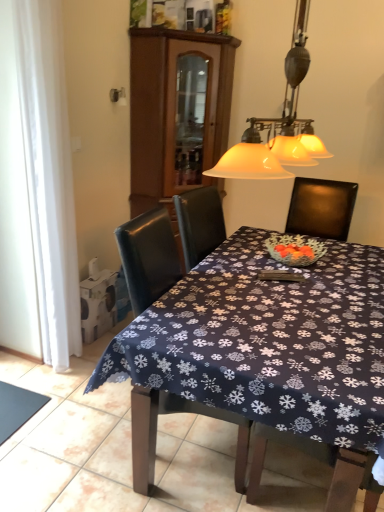
Find the location of a particular element. dark blue fabric at lower left is located at coordinates (17, 408).

The image size is (384, 512). Describe the element at coordinates (148, 257) in the screenshot. I see `leather chair at center` at that location.

Where is `leather chair at center`? leather chair at center is located at coordinates (148, 257).

Locate an element on the screen. This screenshot has height=512, width=384. brown wood cabinet at upper center is located at coordinates (176, 113).

Locate an element on the screen. dark blue fabric at lower left is located at coordinates (17, 408).

Is leather chair at center turned away from brown wood cabinet at upper center?

No.

How many degrees apart are the facing directions of leather chair at center and brown wood cabinet at upper center?

leather chair at center and brown wood cabinet at upper center are facing 44.6 degrees away from each other.

Which is behind, leather chair at center or brown wood cabinet at upper center?

brown wood cabinet at upper center.

Based on the photo, considering the sizes of leather chair at center and brown wood cabinet at upper center in the image, is leather chair at center taller or shorter than brown wood cabinet at upper center?

leather chair at center is shorter than brown wood cabinet at upper center.

Consider the image. Can you confirm if dark blue fabric at lower left is shorter than white glass lampshade at upper center?

Correct, dark blue fabric at lower left is not as tall as white glass lampshade at upper center.

From a real-world perspective, does dark blue fabric at lower left sit lower than white glass lampshade at upper center?

Yes, from a real-world perspective, dark blue fabric at lower left is below white glass lampshade at upper center.

Is leather chair at center positioned far away from dark blue fabric tablecloth at center?

No.

Based on the photo, is dark blue fabric tablecloth at center surrounded by leather chair at center?

No.

From a real-world perspective, which object rests below the other?

dark blue fabric tablecloth at center.

Is leather chair at center aimed at dark blue fabric tablecloth at center?

Yes, leather chair at center faces towards dark blue fabric tablecloth at center.

Is white sheer curtain at left shorter than dark blue fabric at lower left?

No.

From a real-world perspective, is white sheer curtain at left positioned above or below dark blue fabric at lower left?

In terms of real-world spatial position, white sheer curtain at left is above dark blue fabric at lower left.

Does white sheer curtain at left appear on the right side of dark blue fabric at lower left?

Correct, you'll find white sheer curtain at left to the right of dark blue fabric at lower left.

Is white sheer curtain at left situated inside dark blue fabric at lower left or outside?

white sheer curtain at left is outside dark blue fabric at lower left.

Is white sheer curtain at left far away from brown wood cabinet at upper center?

Absolutely, white sheer curtain at left is distant from brown wood cabinet at upper center.

Where is `curtain that is in front of the brown wood cabinet at upper center`? Image resolution: width=384 pixels, height=512 pixels. curtain that is in front of the brown wood cabinet at upper center is located at coordinates (49, 176).

Is white sheer curtain at left thinner than brown wood cabinet at upper center?

Yes, white sheer curtain at left is thinner than brown wood cabinet at upper center.

Can you confirm if white sheer curtain at left is positioned to the left of brown wood cabinet at upper center?

Correct, you'll find white sheer curtain at left to the left of brown wood cabinet at upper center.

Which point is more forward, (236, 166) or (142, 210)?

The point (236, 166) is closer.

Consider the image. Measure the distance between white glass lampshade at upper center and brown wood cabinet at upper center.

They are 1.13 meters apart.

How different are the orientations of white glass lampshade at upper center and brown wood cabinet at upper center in degrees?

They differ by 41 degrees in their facing directions.

Considering the relative sizes of white glass lampshade at upper center and brown wood cabinet at upper center in the image provided, is white glass lampshade at upper center taller than brown wood cabinet at upper center?

No.

Considering the positions of objects dark blue fabric tablecloth at center and brown wood cabinet at upper center in the image provided, who is more to the left, dark blue fabric tablecloth at center or brown wood cabinet at upper center?

From the viewer's perspective, brown wood cabinet at upper center appears more on the left side.

Between dark blue fabric tablecloth at center and brown wood cabinet at upper center, which one has more height?

brown wood cabinet at upper center is taller.

Does point (364, 401) lie in front of point (183, 103)?

Yes, it is.

Find the location of a particular element. This screenshot has width=384, height=512. cabinetry above the dark blue fabric tablecloth at center (from the image's perspective) is located at coordinates (176, 113).

At what (x,y) coordinates should I click in order to perform the action: click on chair in front of the brown wood cabinet at upper center. Please return your answer as a coordinate pair (x, y). Looking at the image, I should click on (148, 257).

Image resolution: width=384 pixels, height=512 pixels. I want to click on lamp above the dark blue fabric at lower left (from the image's perspective), so (278, 124).

From the image, which object appears to be nearer to dark blue fabric at lower left, leather chair at center or brown wood cabinet at upper center?

leather chair at center.

Estimate the real-world distances between objects in this image. Which object is further from white sheer curtain at left, brown wood cabinet at upper center or leather chair at center?

Based on the image, brown wood cabinet at upper center appears to be further to white sheer curtain at left.

From the image, which object appears to be farther from dark blue fabric tablecloth at center, dark blue fabric at lower left or brown wood cabinet at upper center?

The object further to dark blue fabric tablecloth at center is brown wood cabinet at upper center.

Considering their positions, is brown wood cabinet at upper center positioned closer to white glass lampshade at upper center than dark blue fabric tablecloth at center?

dark blue fabric tablecloth at center is positioned closer to the anchor white glass lampshade at upper center.

In the scene shown: Considering their positions, is dark blue fabric at lower left positioned closer to white glass lampshade at upper center than dark blue fabric tablecloth at center?

Among the two, dark blue fabric tablecloth at center is located nearer to white glass lampshade at upper center.

Looking at the image, which one is located closer to white sheer curtain at left, dark blue fabric tablecloth at center or leather chair at center?

leather chair at center lies closer to white sheer curtain at left than the other object.

Considering their positions, is dark blue fabric at lower left positioned further to brown wood cabinet at upper center than dark blue fabric tablecloth at center?

The object further to brown wood cabinet at upper center is dark blue fabric at lower left.

Looking at this image, looking at the image, which one is located further to white glass lampshade at upper center, white sheer curtain at left or dark blue fabric tablecloth at center?

white sheer curtain at left lies further to white glass lampshade at upper center than the other object.

Locate an element on the screen. curtain between dark blue fabric tablecloth at center and brown wood cabinet at upper center from front to back is located at coordinates (49, 176).

Where is `curtain between dark blue fabric at lower left and dark blue fabric tablecloth at center from left to right`? curtain between dark blue fabric at lower left and dark blue fabric tablecloth at center from left to right is located at coordinates (49, 176).

Locate an element on the screen. The width and height of the screenshot is (384, 512). kitchen & dining room table between white glass lampshade at upper center and dark blue fabric at lower left vertically is located at coordinates (268, 342).

In order to click on kitchen & dining room table between white sheer curtain at left and white glass lampshade at upper center from left to right in this screenshot , I will do `click(268, 342)`.